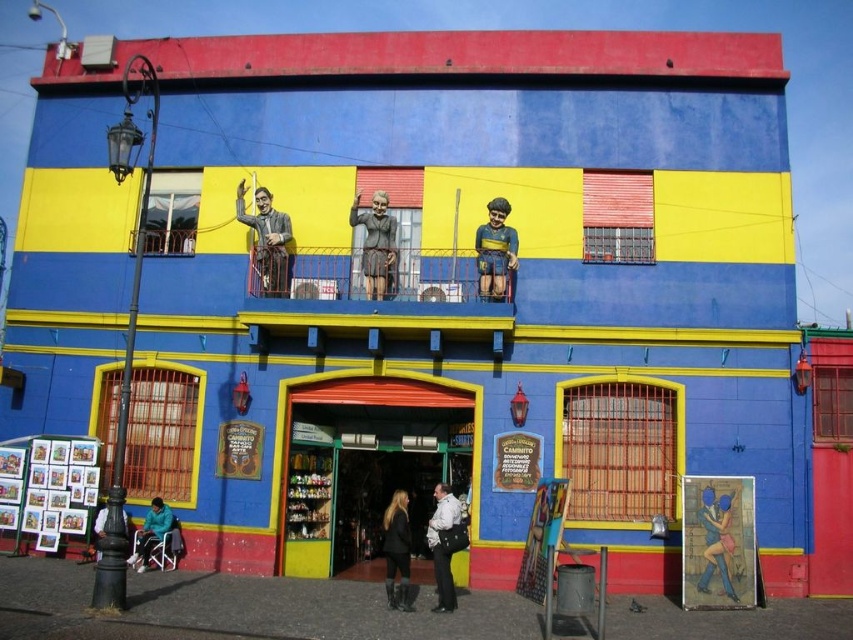
Who is shorter, matte plastic store at center or matte gray statue at upper center?

Standing shorter between the two is matte gray statue at upper center.

Is matte plastic store at center positioned at the back of matte gray statue at upper center?

No, it is not.

Does point (440, 400) come behind point (260, 280)?

No, it is in front of (260, 280).

What are the coordinates of `matte plastic store at center` in the screenshot? It's located at (363, 404).

Between matte plastic store at center and black leather boots at lower center, which one has less height?

Standing shorter between the two is black leather boots at lower center.

Can you confirm if matte plastic store at center is bigger than black leather boots at lower center?

Indeed, matte plastic store at center has a larger size compared to black leather boots at lower center.

I want to click on matte plastic store at center, so click(x=363, y=404).

Locate an element on the screen. This screenshot has height=640, width=853. matte plastic store at center is located at coordinates (363, 404).

From the picture: Does matte gray statue at upper center appear over blue glossy statue at lower right?

Yes, matte gray statue at upper center is above blue glossy statue at lower right.

You are a GUI agent. You are given a task and a screenshot of the screen. Output one action in this format:
    pyautogui.click(x=<x>, y=<y>)
    Task: Click on the matte gray statue at upper center
    The width and height of the screenshot is (853, 640).
    Given the screenshot: What is the action you would take?
    pyautogui.click(x=267, y=240)